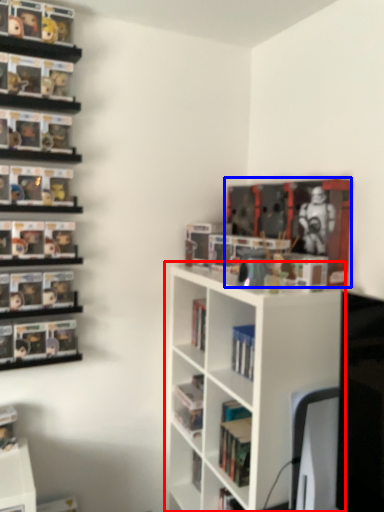
Question: Which object appears closest to the camera in this image, shelf (highlighted by a red box) or book (highlighted by a blue box)?

Choices:
 (A) shelf
 (B) book

Answer: (A)